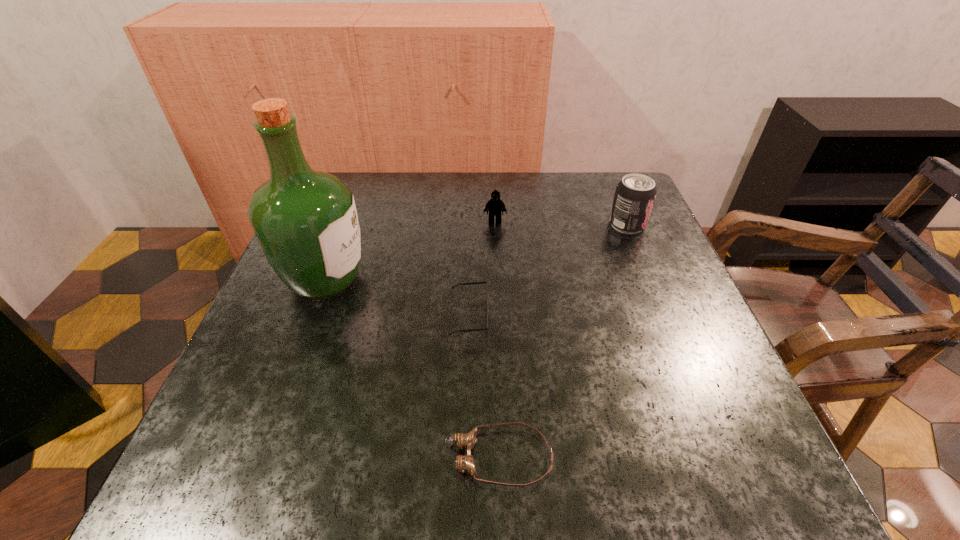
Where is `empty space between the sunglasses and the Lego`? The width and height of the screenshot is (960, 540). empty space between the sunglasses and the Lego is located at coordinates (482, 269).

I want to click on vacant space that's between the leftmost object and the second shortest object, so click(397, 298).

At what (x,y) coordinates should I click in order to perform the action: click on free space between the third shortest object and the rightmost object. Please return your answer as a coordinate pair (x, y). This screenshot has height=540, width=960. Looking at the image, I should click on (561, 223).

Locate an element on the screen. free point between the Lego and the second shortest object is located at coordinates (482, 269).

The height and width of the screenshot is (540, 960). I want to click on free area in between the third tallest object and the liquor, so click(x=410, y=250).

The width and height of the screenshot is (960, 540). What are the coordinates of `free spot between the liquor and the soda can` in the screenshot? It's located at (476, 252).

The image size is (960, 540). I want to click on empty space that is in between the second tallest object and the nearest object, so click(x=563, y=341).

Locate an element on the screen. Image resolution: width=960 pixels, height=540 pixels. object that is the third closest one to the tallest object is located at coordinates (464, 463).

You are a GUI agent. You are given a task and a screenshot of the screen. Output one action in this format:
    pyautogui.click(x=<x>, y=<y>)
    Task: Click on the object that can be found as the second closest to the rightmost object
    The height and width of the screenshot is (540, 960).
    Given the screenshot: What is the action you would take?
    pyautogui.click(x=470, y=283)

Image resolution: width=960 pixels, height=540 pixels. I want to click on free space that satisfies the following two spatial constraints: 1. on the face of the third shortest object; 2. on the front-facing side of the liquor, so click(497, 279).